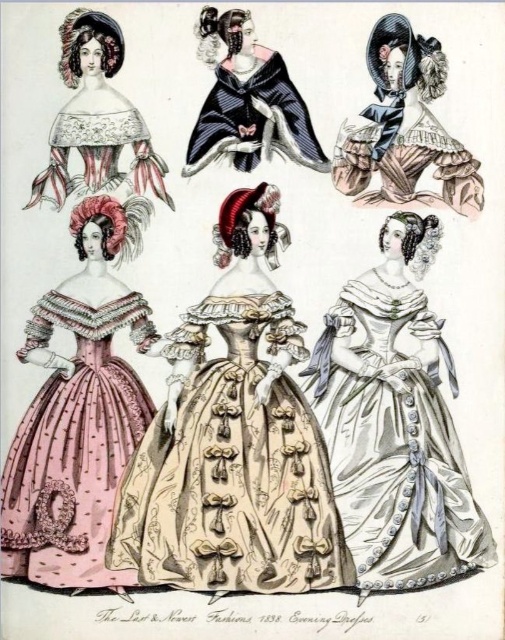
You are an artist trying to sketch the scene. You notice the pink satin dress at left and the velvet black cape at center. Which one appears taller in the illustration?

The pink satin dress at left appears taller than the velvet black cape at center in the illustration.

You are an art curator examining this 19th century fashion plate. You need to determine the spatial relationship between the beige satin gown at center and the matte lace capelet at upper left. Which object is located to the right of the other?

The beige satin gown at center is positioned on the right side of matte lace capelet at upper left.